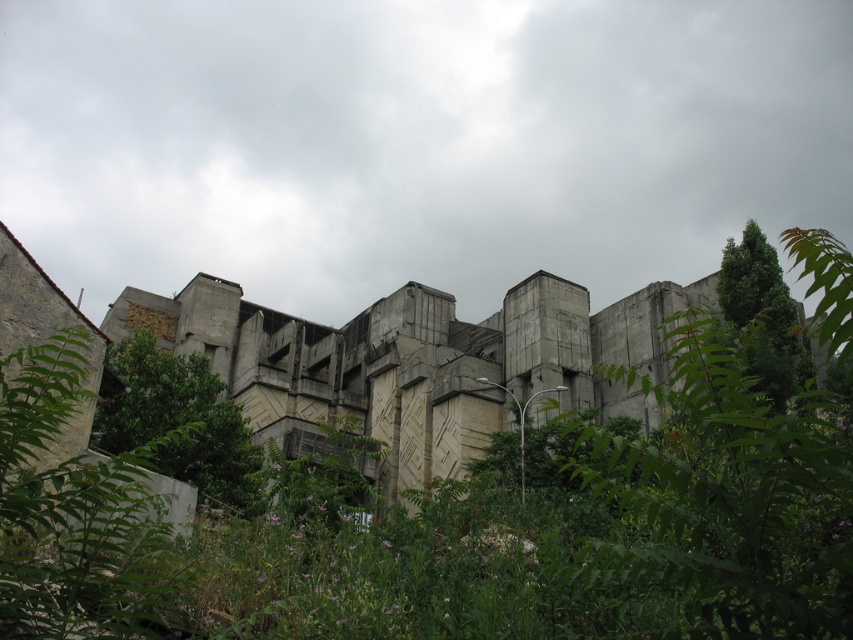
Question: In this image, where is green leafy tree at center located relative to green leafy tree at upper right?

Choices:
 (A) right
 (B) left

Answer: (B)

Question: Is green leafy tree at lower left bigger than green leafy tree at upper right?

Choices:
 (A) no
 (B) yes

Answer: (A)

Question: Among these objects, which one is farthest from the camera?

Choices:
 (A) green leafy tree at center
 (B) green leafy tree at upper right

Answer: (A)

Question: Can you confirm if green leafy tree at lower left is smaller than green leafy tree at upper right?

Choices:
 (A) no
 (B) yes

Answer: (B)

Question: Which of the following is the farthest from the observer?

Choices:
 (A) green leafy tree at upper right
 (B) green leafy tree at lower left

Answer: (A)

Question: Based on their relative distances, which object is nearer to the green leafy tree at center?

Choices:
 (A) green leafy tree at upper right
 (B) green leafy tree at lower left

Answer: (B)